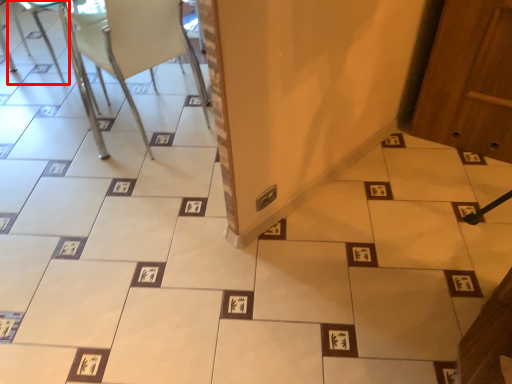
Question: In this image, where is armchair (annotated by the red box) located relative to chair?

Choices:
 (A) right
 (B) left

Answer: (B)